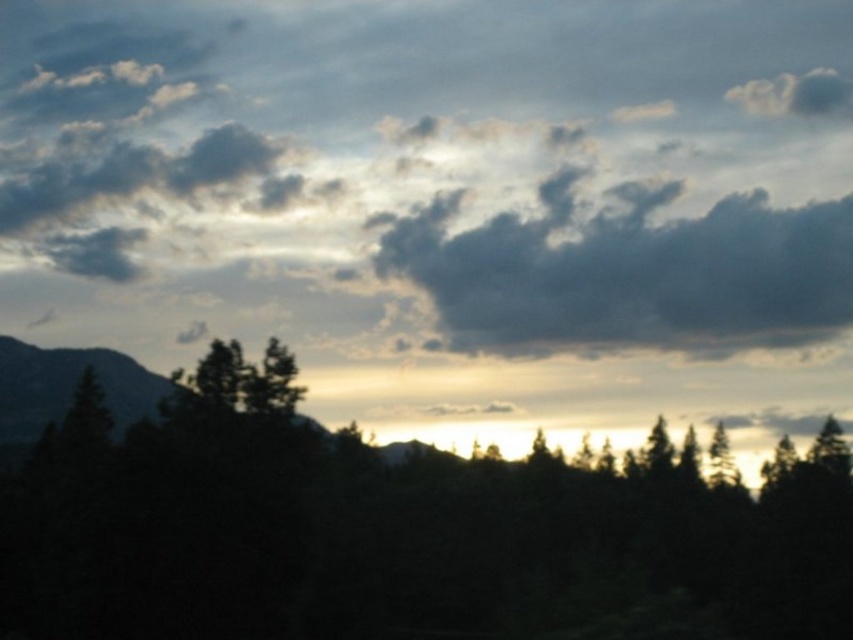
You are an artist painting the sunset scene. You have to decide which object to paint first based on their size. Which one should you start with, the dark green foliage at center or the green matte tree at center?

The dark green foliage at center is larger in size than the green matte tree at center, so you should start with the dark green foliage at center to ensure proper scaling and positioning before detailing smaller elements.

You are an astronomer observing the sunset scene. You notice a point of interest at coordinates point (376, 524). What object is located at that point?

The dark green foliage at center is located at point (376, 524).

You are an artist planning to paint the sunset scene. You need to decide which area to focus on first based on their sizes. Which object should you start with, the dark green foliage at center or the dark gray rocky mountain at left?

The dark green foliage at center has a larger width than the dark gray rocky mountain at left, so you should start with the dark green foliage at center to capture its broader presence first.